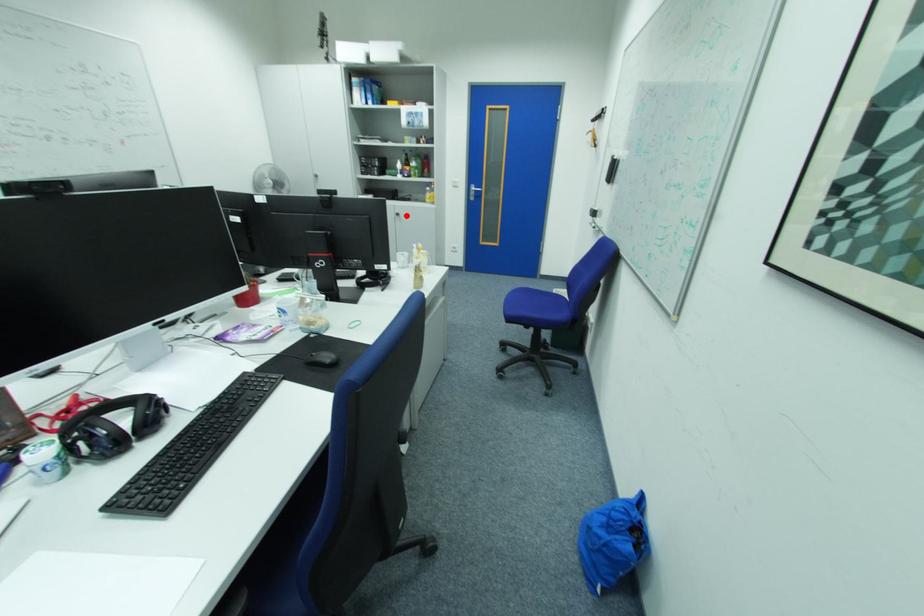
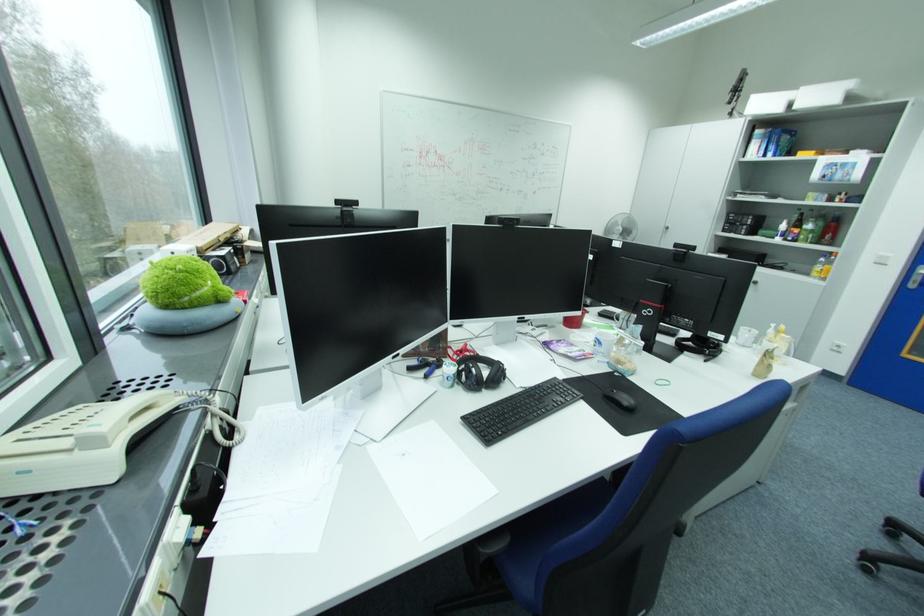
The point at the highlighted location is marked in the first image. Where is the corresponding point in the second image?

(763, 283)